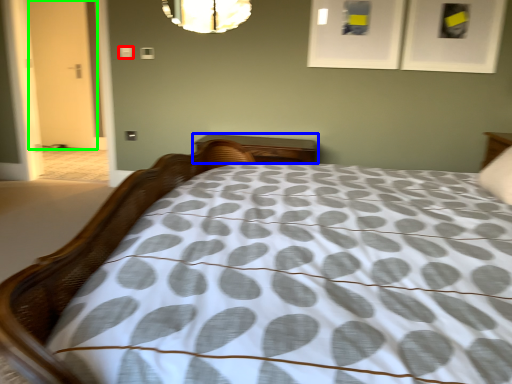
Question: Which object is the closest to the dot (highlighted by a red box)? Choose among these: nightstand (highlighted by a blue box) or door (highlighted by a green box).

Choices:
 (A) nightstand
 (B) door

Answer: (A)